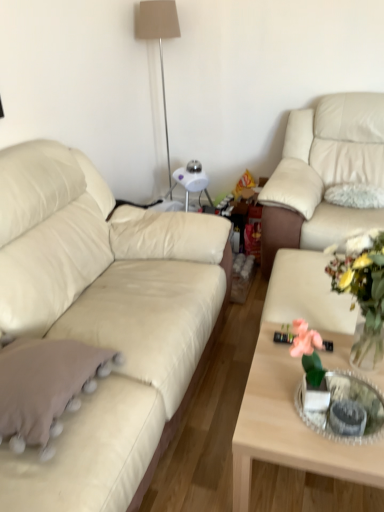
Question: From the image's perspective, is beige leather couch at right, the 1th studio couch from the right, positioned above or below translucent glass vase at center?

Choices:
 (A) below
 (B) above

Answer: (B)

Question: In terms of size, does beige leather couch at right, the 1th studio couch from the right, appear bigger or smaller than translucent glass vase at center?

Choices:
 (A) small
 (B) big

Answer: (B)

Question: Based on their relative distances, which object is farther from the translucent glass vase at center?

Choices:
 (A) matte beige lampshade at upper center
 (B) light wood coffee table at center
 (C) beige leather couch at left, the 2th studio couch when ordered from right to left
 (D) beige leather couch at right, which appears as the second studio couch when viewed from the left
 (E) beige fabric throw pillow at lower left

Answer: (A)

Question: Estimate the real-world distances between objects in this image. Which object is farther from the beige leather couch at left, the 2th studio couch when ordered from right to left?

Choices:
 (A) matte beige lampshade at upper center
 (B) light wood coffee table at center
 (C) beige fabric throw pillow at lower left
 (D) clear glass tray at center
 (E) translucent glass vase at center

Answer: (A)